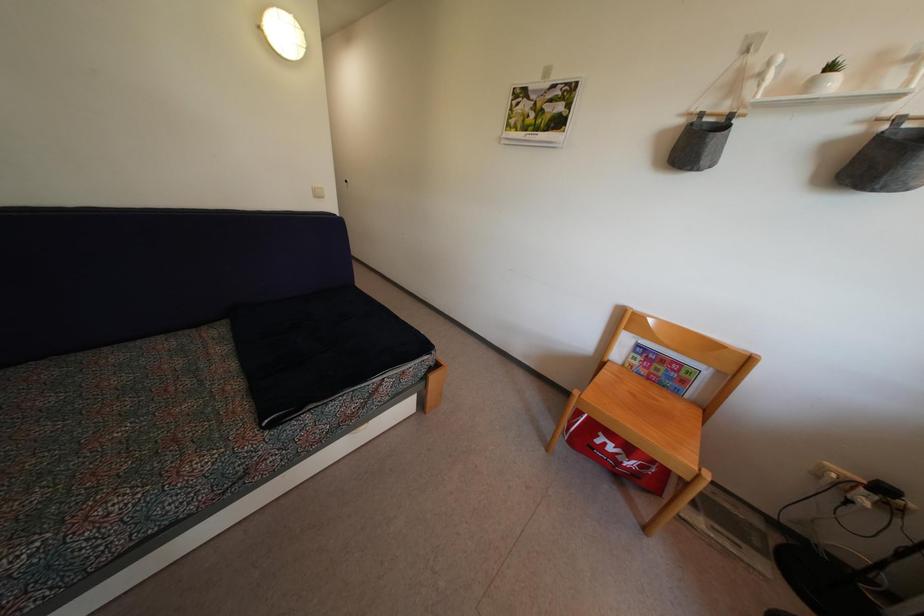
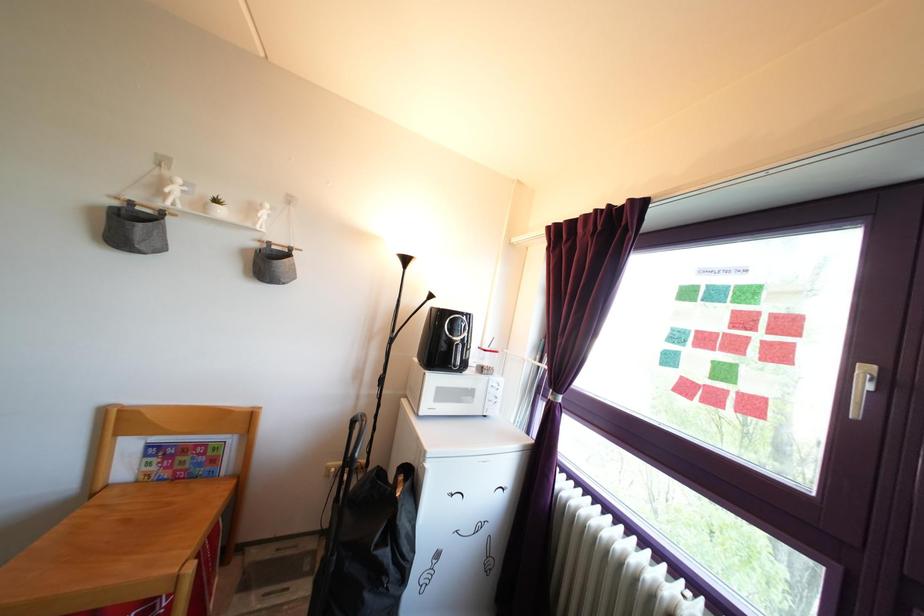
The point at (827, 477) is marked in the first image. Where is the corresponding point in the second image?

(332, 477)